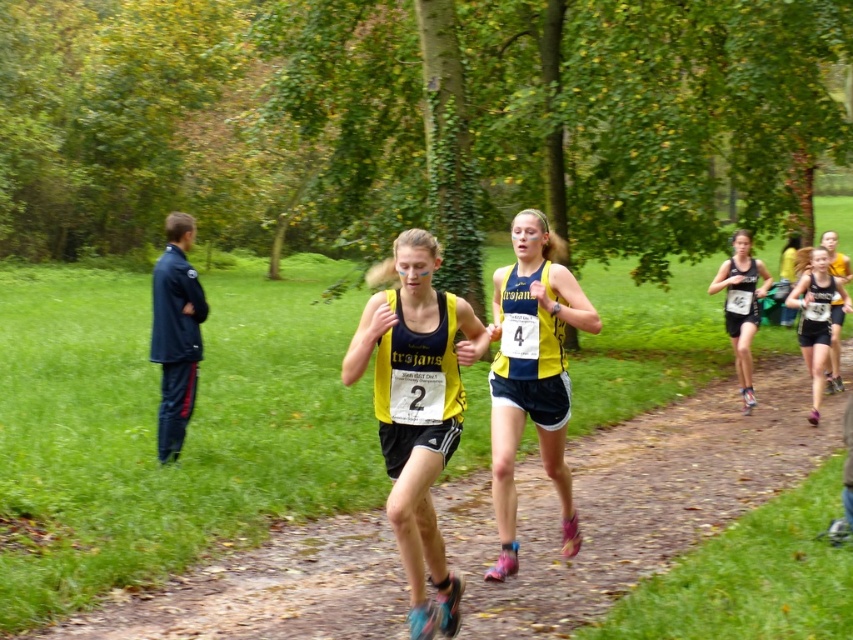
You are a photographer at the cross country race and need to capture a photo of both runners wearing yellow matte tank tops. The first runner is wearing the yellow matte tank top at center and the second runner is wearing the matte yellow tank top at center. Which runner is positioned to the right side of the other?

The yellow matte tank top at center is to the left of the matte yellow tank top at center, so the matte yellow tank top at center is positioned to the right side of the yellow matte tank top at center.

You are a photographer standing at the position of the camera. You want to capture a closeup shot of the yellow matte tank top at center. Given that your camera has a minimum focusing distance of 5 meters, will you be able to take the photo without moving closer?

The yellow matte tank top at center and camera are 4.81 meters apart from each other. Since the minimum focusing distance is 5 meters, the photographer needs to move back to increase the distance to at least 5 meters to capture the closeup shot.